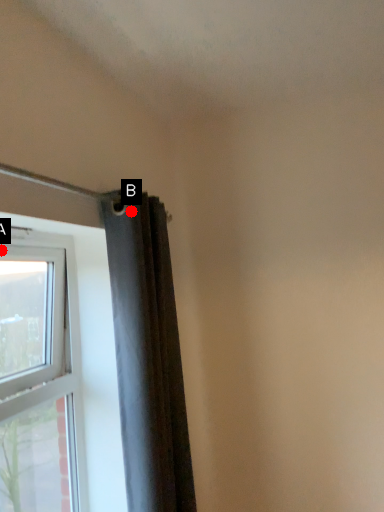
Question: Two points are circled on the image, labeled by A and B beside each circle. Among these points, which one is farthest from the camera?

Choices:
 (A) A is further
 (B) B is further

Answer: (B)